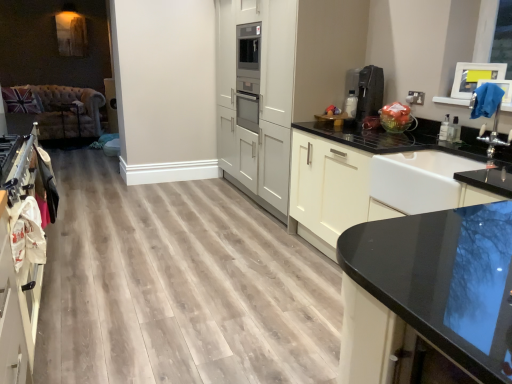
Question: Are white glossy sink at right and white glossy cabinet at center, the third cabinetry positioned from the left, located far from each other?

Choices:
 (A) yes
 (B) no

Answer: (B)

Question: Is white glossy sink at right outside white glossy cabinet at center, the third cabinetry positioned from the left?

Choices:
 (A) no
 (B) yes

Answer: (A)

Question: Is white glossy sink at right oriented away from white glossy cabinet at center, the third cabinetry positioned from the left?

Choices:
 (A) no
 (B) yes

Answer: (B)

Question: Does white glossy sink at right have a larger size compared to white glossy cabinet at center, the third cabinetry positioned from the left?

Choices:
 (A) no
 (B) yes

Answer: (A)

Question: From a real-world perspective, is white glossy sink at right beneath white glossy cabinet at center, the third cabinetry positioned from the left?

Choices:
 (A) yes
 (B) no

Answer: (B)

Question: Is white glossy sink at right shorter than white glossy cabinet at center, the third cabinetry positioned from the left?

Choices:
 (A) no
 (B) yes

Answer: (B)

Question: From the image's perspective, is white glossy sink at right beneath white matte cabinet at left, which is the 1th cabinetry from left to right?

Choices:
 (A) no
 (B) yes

Answer: (A)

Question: Is white matte cabinet at left, the third cabinetry positioned from the right, at the back of white glossy sink at right?

Choices:
 (A) no
 (B) yes

Answer: (A)

Question: Considering the relative sizes of white glossy sink at right and white matte cabinet at left, which is the 1th cabinetry from left to right, in the image provided, is white glossy sink at right taller than white matte cabinet at left, which is the 1th cabinetry from left to right,?

Choices:
 (A) no
 (B) yes

Answer: (A)

Question: Does white glossy sink at right appear on the right side of white matte cabinet at left, which is the 1th cabinetry from left to right?

Choices:
 (A) yes
 (B) no

Answer: (A)

Question: Does white glossy sink at right have a lesser height compared to white matte cabinet at left, the third cabinetry positioned from the right?

Choices:
 (A) no
 (B) yes

Answer: (B)

Question: Is white glossy sink at right outside white matte cabinet at left, which is the 1th cabinetry from left to right?

Choices:
 (A) no
 (B) yes

Answer: (B)

Question: From a real-world perspective, is white glossy cabinet at center, the third cabinetry positioned from the left, physically below white matte cabinetry at center, placed as the 2th cabinetry when sorted from left to right?

Choices:
 (A) no
 (B) yes

Answer: (B)